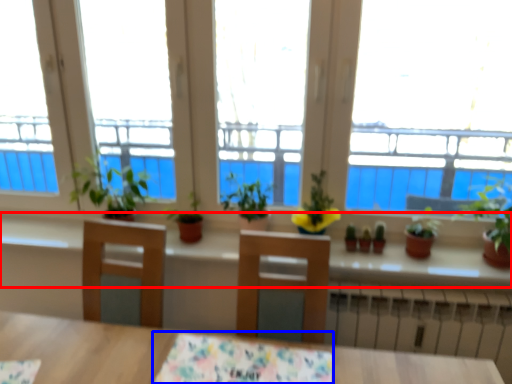
Question: Which point is further to the camera, window sill (highlighted by a red box) or tablecloth (highlighted by a blue box)?

Choices:
 (A) window sill
 (B) tablecloth

Answer: (A)